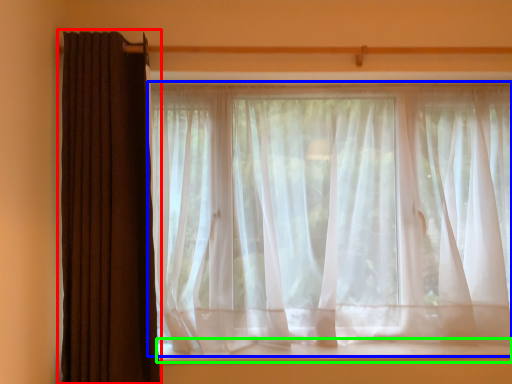
Question: Based on their relative distances, which object is farther from curtain (highlighted by a red box)? Choose from curtain (highlighted by a blue box) and window sill (highlighted by a green box).

Choices:
 (A) curtain
 (B) window sill

Answer: (B)